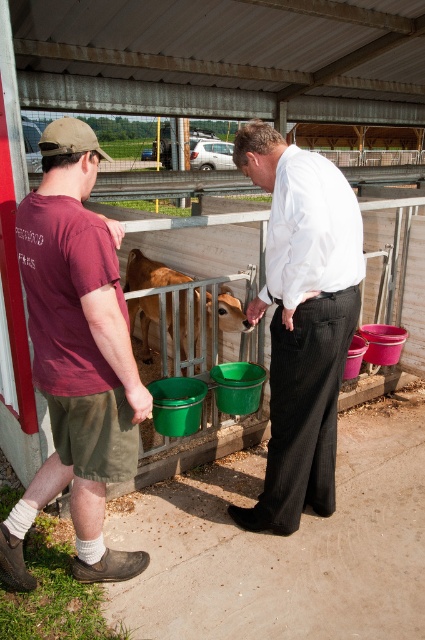
Between point (84, 312) and point (314, 186), which one is positioned in front?

Point (84, 312) is in front.

Does maroon cotton t-shirt at left have a smaller size compared to white smooth shirt at center?

Yes.

You are a GUI agent. You are given a task and a screenshot of the screen. Output one action in this format:
    pyautogui.click(x=<x>, y=<y>)
    Task: Click on the maroon cotton t-shirt at left
    
    Given the screenshot: What is the action you would take?
    pyautogui.click(x=76, y=356)

Locate an element on the screen. The height and width of the screenshot is (640, 425). maroon cotton t-shirt at left is located at coordinates [x=76, y=356].

Who is positioned more to the right, maroon cotton t-shirt at left or brown matte calf at center?

brown matte calf at center is more to the right.

Describe the element at coordinates (76, 356) in the screenshot. I see `maroon cotton t-shirt at left` at that location.

This screenshot has width=425, height=640. I want to click on maroon cotton t-shirt at left, so click(76, 356).

I want to click on white smooth shirt at center, so click(x=302, y=321).

Is white smooth shirt at center closer to the viewer compared to brown matte calf at center?

Yes, white smooth shirt at center is in front of brown matte calf at center.

Is point (292, 349) positioned after point (138, 276)?

No, it is not.

Locate an element on the screen. white smooth shirt at center is located at coordinates (302, 321).